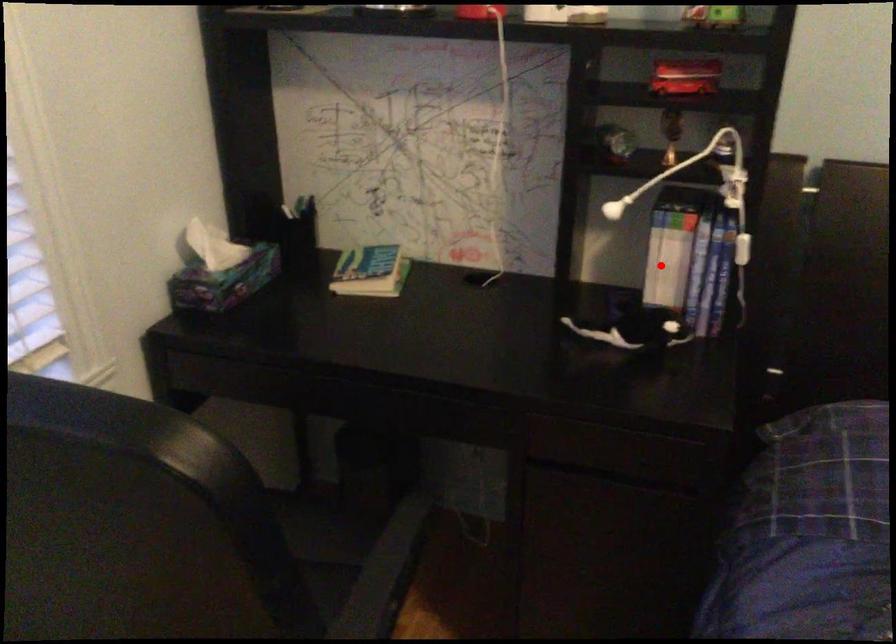
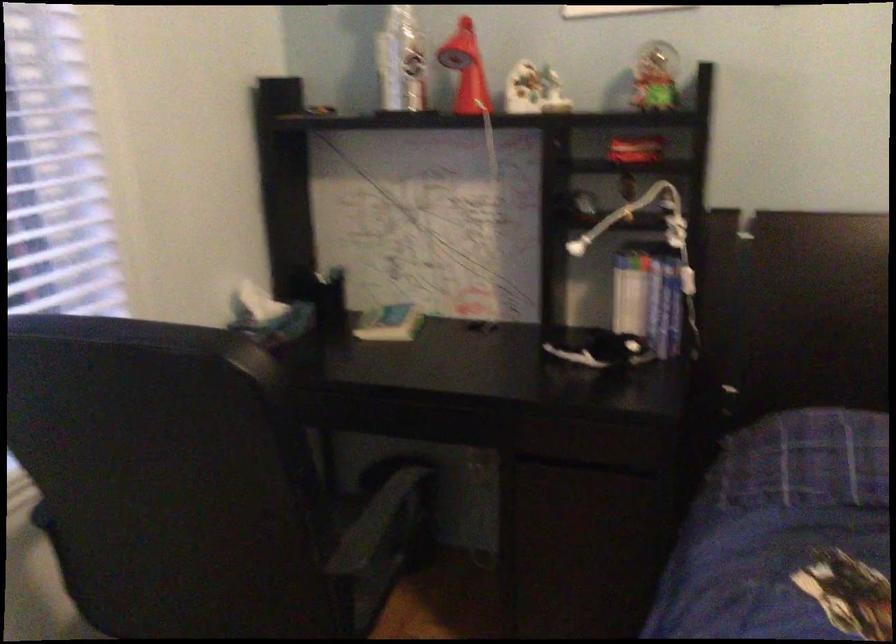
Question: A red point is marked in image1. In image2, is the corresponding 3D point closer to the camera or farther? Reply with the corresponding letter.

Choices:
 (A) The corresponding 3D point is closer.
 (B) The corresponding 3D point is farther.

Answer: (B)